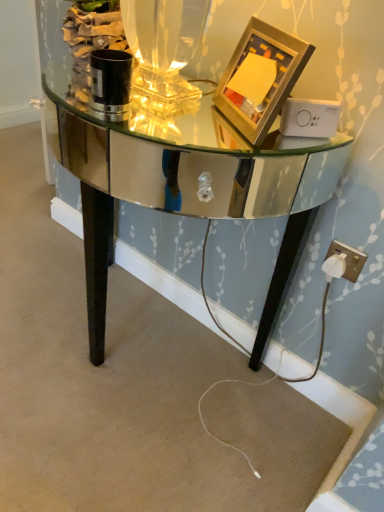
The image size is (384, 512). What do you see at coordinates (334, 266) in the screenshot?
I see `white plastic plug at lower right` at bounding box center [334, 266].

The height and width of the screenshot is (512, 384). Identify the location of white plastic plug at lower right. (348, 259).

The height and width of the screenshot is (512, 384). What are the coordinates of `mirrored glass table at center` in the screenshot? It's located at (188, 187).

Can you confirm if white plastic plug at lower right is positioned to the left of mirrored glass table at center?

No.

Consider the image. Which of these two, white plastic plug at lower right or mirrored glass table at center, is smaller?

white plastic plug at lower right.

Consider the image. In the image, is white plastic plug at lower right positioned in front of or behind mirrored glass table at center?

Visually, white plastic plug at lower right is located behind mirrored glass table at center.

Can you tell me how much gold metallic picture frame at upper right and white plastic plug at lower right differ in facing direction?

They differ by 32.9 degrees in their facing directions.

At what (x,y) coordinates should I click in order to perform the action: click on picture frame on the left of white plastic plug at lower right. Please return your answer as a coordinate pair (x, y). The width and height of the screenshot is (384, 512). Looking at the image, I should click on (269, 80).

Would you consider gold metallic picture frame at upper right to be distant from white plastic plug at lower right?

gold metallic picture frame at upper right is actually quite close to white plastic plug at lower right.

Looking at this image, which object is further away from the camera taking this photo, gold metallic picture frame at upper right or white plastic plug at lower right?

white plastic plug at lower right is further from the camera.

How different are the orientations of mirrored glass table at center and white plastic plug at lower right in degrees?

They differ by 1.05 degrees in their facing directions.

From a real-world perspective, is mirrored glass table at center positioned over white plastic plug at lower right based on gravity?

No, from a real-world perspective, mirrored glass table at center is not over white plastic plug at lower right

Is mirrored glass table at center to the left of white plastic plug at lower right from the viewer's perspective?

Correct, you'll find mirrored glass table at center to the left of white plastic plug at lower right.

Is mirrored glass table at center spatially inside white plastic plug at lower right, or outside of it?

mirrored glass table at center is not enclosed by white plastic plug at lower right.

In the scene shown: From a real-world perspective, which object rests below the other?

mirrored glass table at center, from a real-world perspective.

Is gold metallic picture frame at upper right inside mirrored glass table at center?

No, gold metallic picture frame at upper right is located outside of mirrored glass table at center.

Is mirrored glass table at center aimed at gold metallic picture frame at upper right?

No, mirrored glass table at center does not turn towards gold metallic picture frame at upper right.

Considering the relative positions of mirrored glass table at center and gold metallic picture frame at upper right in the image provided, is mirrored glass table at center to the left of gold metallic picture frame at upper right from the viewer's perspective?

Yes.

Does white plastic plug at lower right have a greater height compared to mirrored glass table at center?

Incorrect, the height of white plastic plug at lower right is not larger of that of mirrored glass table at center.

Is white plastic plug at lower right oriented towards mirrored glass table at center?

No, white plastic plug at lower right is not turned towards mirrored glass table at center.

Does white plastic plug at lower right come behind mirrored glass table at center?

Yes, it is.

Measure the distance from white plastic plug at lower right to mirrored glass table at center.

The distance of white plastic plug at lower right from mirrored glass table at center is 28.84 inches.

Is mirrored glass table at center positioned beyond the bounds of white plastic plug at lower right?

Yes.

Which object is closer to the camera, mirrored glass table at center or white plastic plug at lower right?

mirrored glass table at center.

From the image's perspective, who appears lower, mirrored glass table at center or white plastic plug at lower right?

white plastic plug at lower right is shown below in the image.

Looking at their sizes, would you say mirrored glass table at center is wider or thinner than white plastic plug at lower right?

mirrored glass table at center is wider than white plastic plug at lower right.

From the image's perspective, is white plastic plug at lower right located above or below gold metallic picture frame at upper right?

white plastic plug at lower right is below gold metallic picture frame at upper right.

Is white plastic plug at lower right facing away from gold metallic picture frame at upper right?

white plastic plug at lower right does not have its back to gold metallic picture frame at upper right.

Considering the points (344, 263) and (270, 45), which point is in front, point (344, 263) or point (270, 45)?

The point (270, 45) is closer.

Which object is closer to the camera taking this photo, white plastic plug at lower right or gold metallic picture frame at upper right?

gold metallic picture frame at upper right is closer to the camera.

Identify the location of plug located above the mirrored glass table at center (from a real-world perspective). The image size is (384, 512). (334, 266).

You are a GUI agent. You are given a task and a screenshot of the screen. Output one action in this format:
    pyautogui.click(x=<x>, y=<y>)
    Task: Click on the picture frame in front of the white plastic plug at lower right
    Image resolution: width=384 pixels, height=512 pixels.
    Given the screenshot: What is the action you would take?
    pyautogui.click(x=269, y=80)

When comparing their distances from white plastic plug at lower right, does white plastic plug at lower right or mirrored glass table at center seem closer?

The object closer to white plastic plug at lower right is white plastic plug at lower right.

Considering their positions, is gold metallic picture frame at upper right positioned closer to white plastic plug at lower right than white plastic plug at lower right?

white plastic plug at lower right is positioned closer to the anchor white plastic plug at lower right.

Which object lies nearer to the anchor point gold metallic picture frame at upper right, white plastic plug at lower right or mirrored glass table at center?

mirrored glass table at center.

From the image, which object appears to be farther from mirrored glass table at center, white plastic plug at lower right or white plastic plug at lower right?

The object further to mirrored glass table at center is white plastic plug at lower right.

When comparing their distances from gold metallic picture frame at upper right, does mirrored glass table at center or white plastic plug at lower right seem closer?

Based on the image, white plastic plug at lower right appears to be nearer to gold metallic picture frame at upper right.

Estimate the real-world distances between objects in this image. Which object is closer to mirrored glass table at center, gold metallic picture frame at upper right or white plastic plug at lower right?

gold metallic picture frame at upper right lies closer to mirrored glass table at center than the other object.

When comparing their distances from mirrored glass table at center, does gold metallic picture frame at upper right or white plastic plug at lower right seem closer?

Among the two, gold metallic picture frame at upper right is located nearer to mirrored glass table at center.

Estimate the real-world distances between objects in this image. Which object is further from gold metallic picture frame at upper right, white plastic plug at lower right or white plastic plug at lower right?

white plastic plug at lower right is further to gold metallic picture frame at upper right.

The width and height of the screenshot is (384, 512). In order to click on picture frame between mirrored glass table at center and white plastic plug at lower right in the horizontal direction in this screenshot , I will do `click(269, 80)`.

Identify the location of plug located between mirrored glass table at center and white plastic plug at lower right in the left-right direction. (334, 266).

The height and width of the screenshot is (512, 384). I want to click on electric outlet between gold metallic picture frame at upper right and white plastic plug at lower right from top to bottom, so click(348, 259).

At what (x,y) coordinates should I click in order to perform the action: click on picture frame between mirrored glass table at center and white plastic plug at lower right in the horizontal direction. Please return your answer as a coordinate pair (x, y). Looking at the image, I should click on (269, 80).